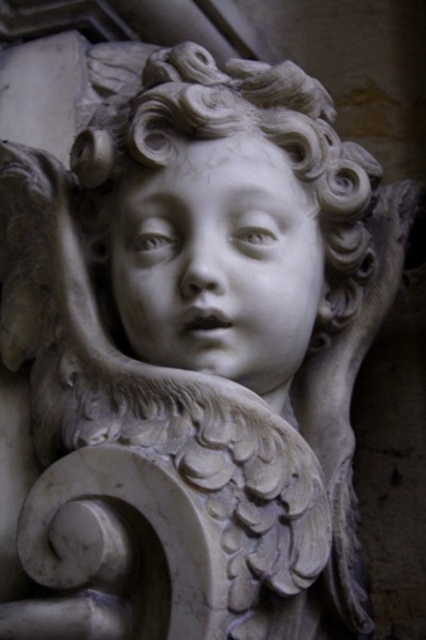
Looking at the marble sculpture, you notice the white marble head at center and the white marble face at center. Which one of these two objects is bigger in size?

The white marble head at center is larger in size compared to the white marble face at center.

Looking at the marble sculpture, where is the white marble head at center in relation to the white marble face at center?

The white marble head at center is above the white marble face at center.

You are an art student analyzing the marble sculpture. You notice the white marble head at center and the white marble face at center. Which part is closer to you?

The white marble head at center is closer to you because it is in front of the white marble face at center.